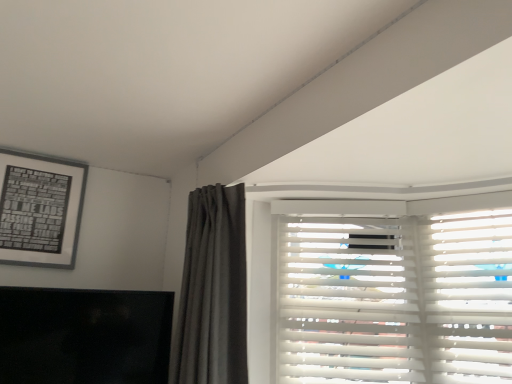
Describe the element at coordinates (84, 336) in the screenshot. I see `black matte tv at lower left` at that location.

In order to face black matte picture frame at upper left, should I rotate leftwards or rightwards?

Rotate your view left by about 27.289°.

Describe the element at coordinates (40, 209) in the screenshot. The height and width of the screenshot is (384, 512). I see `black matte picture frame at upper left` at that location.

In order to click on black matte tv at lower left in this screenshot , I will do `click(84, 336)`.

Does black matte tv at lower left touch white wood blinds at upper right?

No.

Is black matte tv at lower left located outside white wood blinds at upper right?

Absolutely, black matte tv at lower left is external to white wood blinds at upper right.

From the image's perspective, is black matte tv at lower left below white wood blinds at upper right?

Correct, black matte tv at lower left appears lower than white wood blinds at upper right in the image.

Which is nearer, (499,327) or (12,259)?

Clearly, point (499,327) is closer to the camera than point (12,259).

From the image's perspective, which object appears higher, white wood blinds at upper right or black matte picture frame at upper left?

black matte picture frame at upper left is shown above in the image.

Would you say white wood blinds at upper right is inside or outside black matte picture frame at upper left?

white wood blinds at upper right lies outside black matte picture frame at upper left.

Based on the photo, considering the positions of objects white wood blinds at upper right and black matte picture frame at upper left in the image provided, who is more to the right, white wood blinds at upper right or black matte picture frame at upper left?

white wood blinds at upper right.

Considering the positions of points (63, 177) and (100, 291), is point (63, 177) farther from camera compared to point (100, 291)?

Yes.

Is black matte picture frame at upper left situated inside black matte tv at lower left or outside?

black matte picture frame at upper left lies outside black matte tv at lower left.

Locate an element on the screen. This screenshot has height=384, width=512. picture frame on the left of black matte tv at lower left is located at coordinates (40, 209).

Are black matte picture frame at upper left and black matte tv at lower left located far from each other?

No, there isn't a large distance between black matte picture frame at upper left and black matte tv at lower left.

Can you tell me how much black matte tv at lower left and black matte picture frame at upper left differ in facing direction?

The angle between the facing direction of black matte tv at lower left and the facing direction of black matte picture frame at upper left is 13.1 degrees.

Looking at this image, can you confirm if black matte tv at lower left is positioned to the right of black matte picture frame at upper left?

Yes, black matte tv at lower left is to the right of black matte picture frame at upper left.

Considering the relative sizes of black matte tv at lower left and black matte picture frame at upper left in the image provided, is black matte tv at lower left wider than black matte picture frame at upper left?

Yes.

Based on the photo, is the position of black matte tv at lower left less distant than that of black matte picture frame at upper left?

Yes, it is in front of black matte picture frame at upper left.

Are white wood blinds at upper right and black matte tv at lower left making contact?

There is a gap between white wood blinds at upper right and black matte tv at lower left.

Is black matte tv at lower left at the back of white wood blinds at upper right?

white wood blinds at upper right does not have its back to black matte tv at lower left.

How distant is white wood blinds at upper right from black matte tv at lower left?

white wood blinds at upper right and black matte tv at lower left are 89.59 centimeters apart from each other.

Which object is more forward, white wood blinds at upper right or black matte tv at lower left?

black matte tv at lower left is more forward.

Is black matte picture frame at upper left beside white wood blinds at upper right?

No.

Could you tell me if black matte picture frame at upper left is facing white wood blinds at upper right?

No, black matte picture frame at upper left is not turned towards white wood blinds at upper right.

From the image's perspective, which one is positioned higher, black matte picture frame at upper left or white wood blinds at upper right?

black matte picture frame at upper left is shown above in the image.

In the scene shown: Can you confirm if black matte picture frame at upper left is bigger than white wood blinds at upper right?

Actually, black matte picture frame at upper left might be smaller than white wood blinds at upper right.

This screenshot has width=512, height=384. I want to click on window blind above the black matte tv at lower left (from the image's perspective), so click(396, 299).

Locate an element on the screen. The image size is (512, 384). window blind to the right of black matte picture frame at upper left is located at coordinates (396, 299).

Looking at the image, which one is located further to black matte picture frame at upper left, white wood blinds at upper right or black matte tv at lower left?

white wood blinds at upper right.

Which object lies nearer to the anchor point black matte tv at lower left, black matte picture frame at upper left or white wood blinds at upper right?

→ The object closer to black matte tv at lower left is black matte picture frame at upper left.

Considering their positions, is black matte picture frame at upper left positioned closer to white wood blinds at upper right than black matte tv at lower left?

Based on the image, black matte tv at lower left appears to be nearer to white wood blinds at upper right.

Estimate the real-world distances between objects in this image. Which object is further from black matte tv at lower left, white wood blinds at upper right or black matte picture frame at upper left?

white wood blinds at upper right is positioned further to the anchor black matte tv at lower left.

Looking at the image, which one is located further to black matte picture frame at upper left, black matte tv at lower left or white wood blinds at upper right?

white wood blinds at upper right is further to black matte picture frame at upper left.

Based on the photo, based on their spatial positions, is black matte tv at lower left or black matte picture frame at upper left closer to white wood blinds at upper right?

Based on the image, black matte tv at lower left appears to be nearer to white wood blinds at upper right.

The image size is (512, 384). I want to click on window screen situated between black matte picture frame at upper left and white wood blinds at upper right from left to right, so click(84, 336).